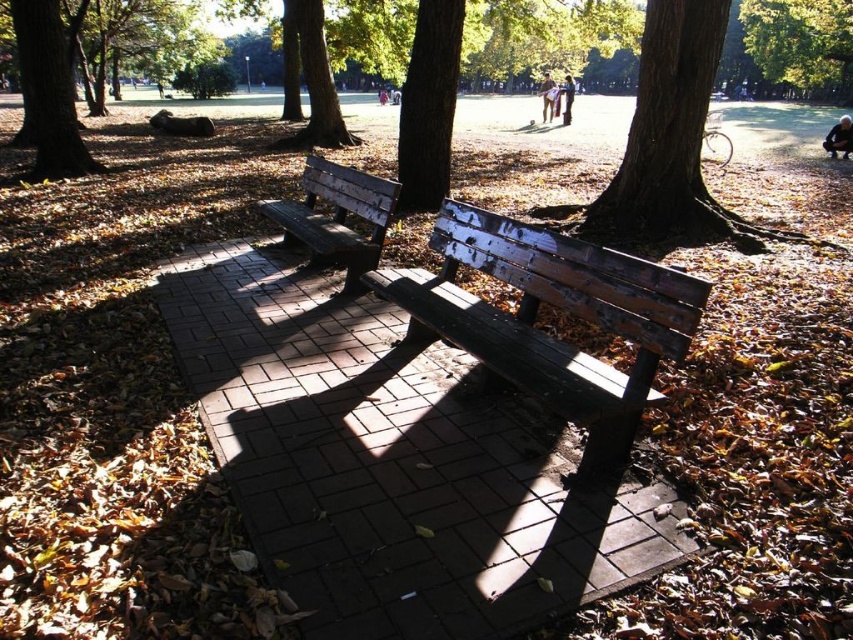
Question: Is brown rough bark tree at center bigger than light brown leather jacket at upper center?

Choices:
 (A) no
 (B) yes

Answer: (A)

Question: Which object is farther from the camera taking this photo?

Choices:
 (A) brown rough bark tree at center
 (B) smooth brown tree trunk at center
 (C) dark blue jeans at lower right

Answer: (C)

Question: In this image, where is wooden bench at center located relative to light brown leather jacket at upper center?

Choices:
 (A) left
 (B) right

Answer: (A)

Question: Which object is farther from the camera taking this photo?

Choices:
 (A) weathered wood bench at center
 (B) dark blue jeans at lower right
 (C) light brown wooden bench at center
 (D) smooth brown tree trunk at center

Answer: (C)

Question: Which point is closer to the camera?

Choices:
 (A) light brown leather jacket at upper center
 (B) brown rough bark tree at center

Answer: (B)

Question: Is brown rough tree at upper left smaller than wooden bench at center?

Choices:
 (A) no
 (B) yes

Answer: (A)